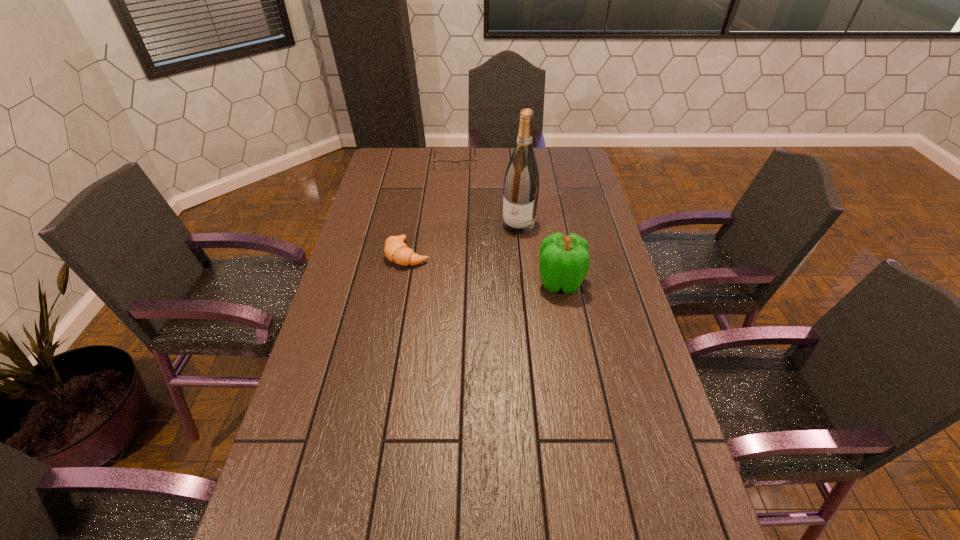
The image size is (960, 540). I want to click on crescent roll, so click(x=396, y=251).

The width and height of the screenshot is (960, 540). In order to click on the third shortest object in this screenshot , I will do `click(564, 262)`.

This screenshot has width=960, height=540. I want to click on the tallest object, so point(521,183).

Where is `wine bottle`? This screenshot has width=960, height=540. wine bottle is located at coordinates (521, 183).

I want to click on the shortest object, so click(x=465, y=164).

Where is `the farthest object`? the farthest object is located at coordinates (465, 164).

This screenshot has width=960, height=540. I want to click on free location located 0.270m on the front of the second shortest object, so (394, 336).

Image resolution: width=960 pixels, height=540 pixels. What are the coordinates of `free location located 0.300m on the front of the bell pepper` in the screenshot? It's located at (579, 385).

Find the location of a particular element. Image resolution: width=960 pixels, height=540 pixels. vacant space located 0.230m on the label of the second farthest object is located at coordinates (491, 275).

Locate an element on the screen. The image size is (960, 540). free space located 0.310m on the label of the second farthest object is located at coordinates (481, 293).